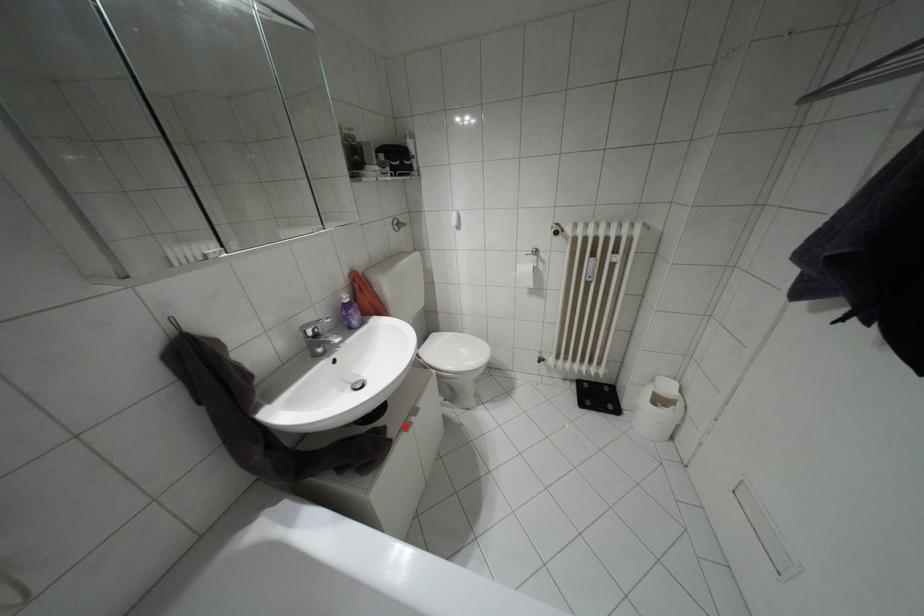
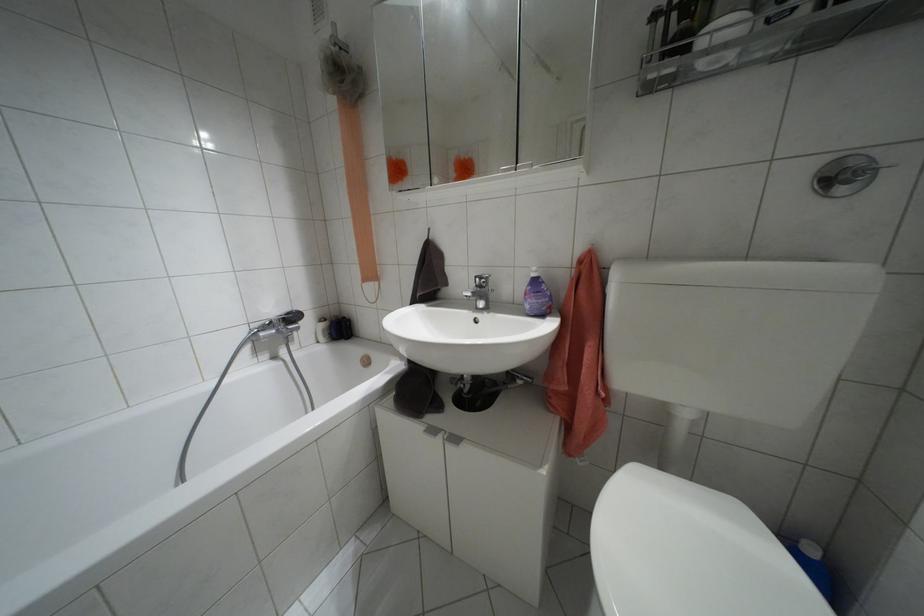
In the second image, find the point that corresponds to the highlighted location in the first image.

(432, 430)